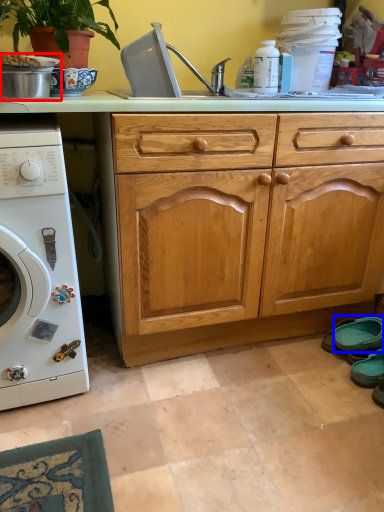
Question: Which point is closer to the camera, appliance (highlighted by a red box) or shoe (highlighted by a blue box)?

Choices:
 (A) appliance
 (B) shoe

Answer: (A)